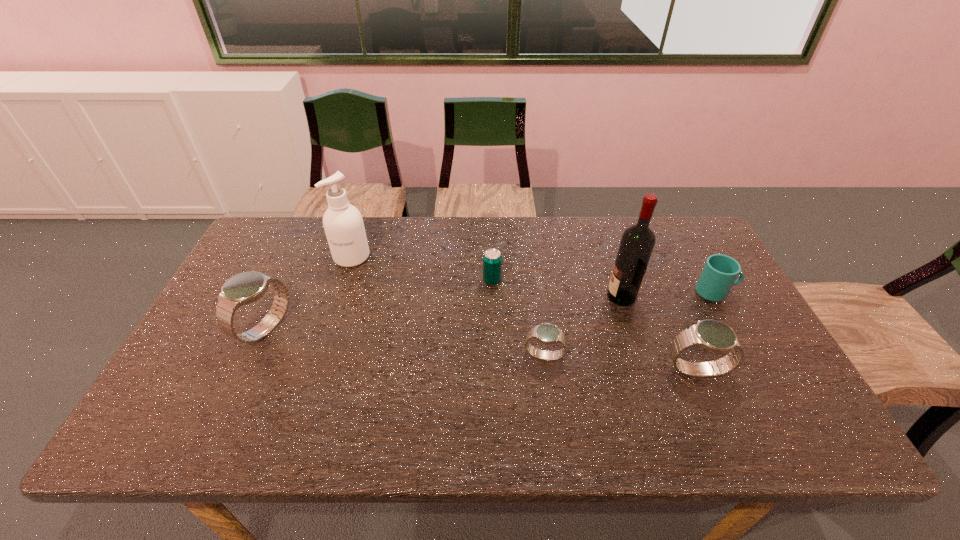
Identify the location of the second closest object relative to the shortest watch. (492, 260).

Find the location of a particular element. watch that is the closest to the fifth object from left to right is located at coordinates (712, 335).

Point out which watch is positioned as the nearest to the fourth object from right to left. Please provide its 2D coordinates. Your answer should be formatted as a tuple, i.e. [(x, y)], where the tuple contains the x and y coordinates of a point satisfying the conditions above.

[(712, 335)]

Where is `vacant area that satisfies the following two spatial constraints: 1. on the front and back of the fifth object from left to right; 2. on the front side of the leftmost object`? vacant area that satisfies the following two spatial constraints: 1. on the front and back of the fifth object from left to right; 2. on the front side of the leftmost object is located at coordinates (632, 329).